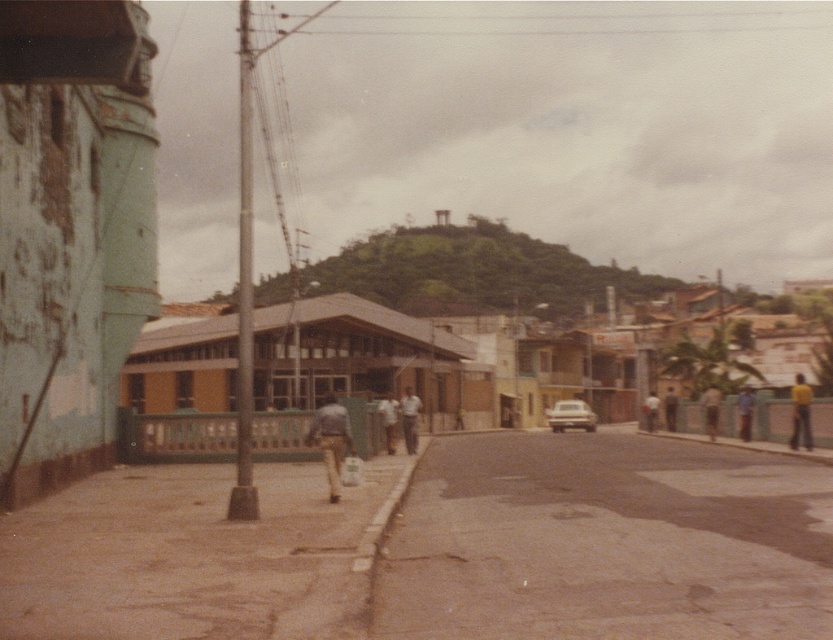
You are a photographer standing on the sidewalk and want to take a photo of the yellow matte shirt at right and the blue denim shirt at right. Which one should you focus on first if you want to capture both in the same frame without moving the camera?

The yellow matte shirt at right is taller than the blue denim shirt at right, so you should focus on the yellow matte shirt at right first to ensure both are in focus since it is farther away.

A person wearing a yellow matte shirt at right is standing on the sidewalk. A utility pole is in the middle of the sidewalk. If the person wants to walk past the utility pole without getting too close, what is the minimum distance they should maintain between themselves and the pole?

The minimum distance they should maintain is 73.76 feet to avoid getting too close to the utility pole.

You are a pedestrian trying to walk from the left side of the sidewalk to the right side. There are two obstacles in your path, the light brown leather pants at center and the blue denim shirt at right. Which obstacle is narrower, allowing you to pass through more easily?

The light brown leather pants at center is thinner than the blue denim shirt at right, so you can pass through the area near the light brown leather pants at center more easily.